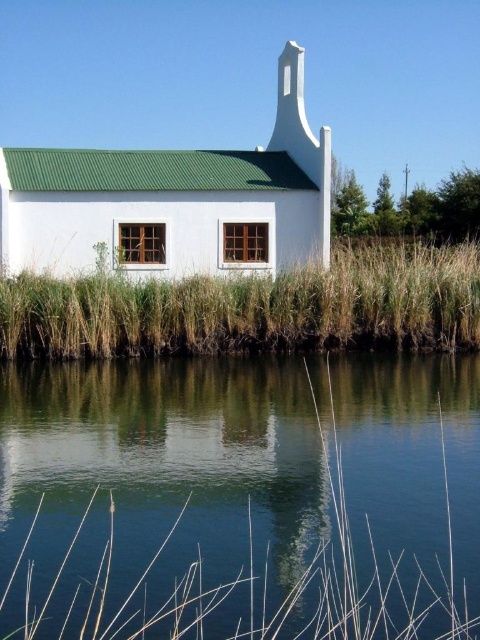
Based on the photo, you are a drone operator trying to capture a photo of the white matte church at center. The drone is currently at point A, which is at coordinate 0.2,0.2. To reach the church, you need to move the drone in which direction? Please specify the direction as either north, south, east, or west.

The white matte church at center is located at coordinates (173, 202). Since the drone is at (96, 128), it needs to move northeast to reach the church.

You are a frog attempting to jump from the brown grass at lower center to the clear blue water at lower center. Considering their widths, which one is wider and can provide a safer landing spot?

The brown grass at lower center is wider than the clear blue water at lower center, so it would provide a safer landing spot for the frog.